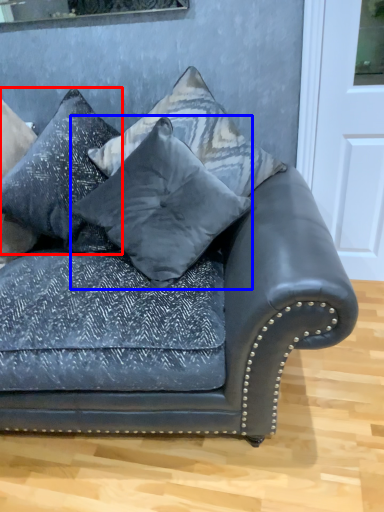
Question: Which point is further to the camera, pillow (highlighted by a red box) or pillow (highlighted by a blue box)?

Choices:
 (A) pillow
 (B) pillow

Answer: (A)